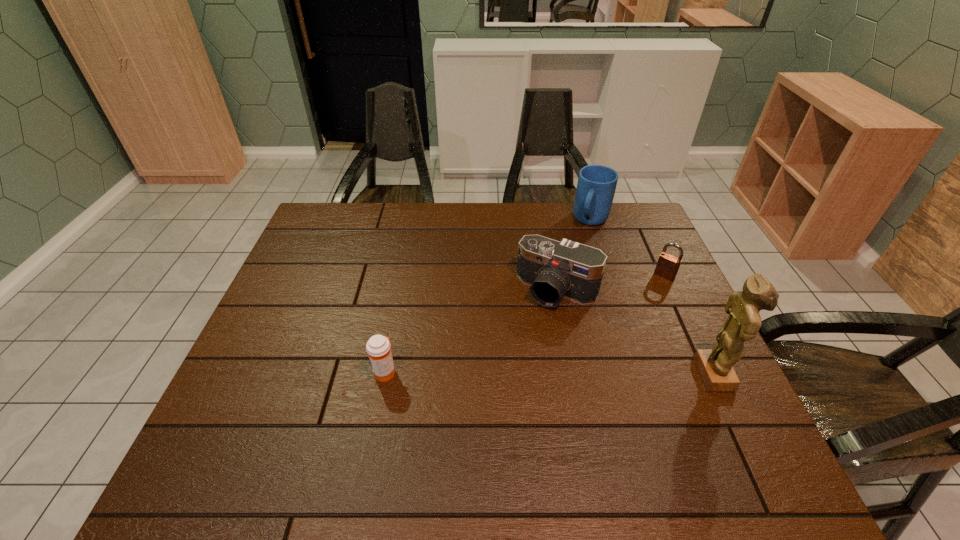
This screenshot has height=540, width=960. Identify the location of vacant space on the desktop that is between the leftmost object and the figurine and is positioned on the front-facing side of the camera. (507, 373).

In order to click on free space on the desktop that is between the leftmost object and the figurine and is positioned on the side of the mug with the handle in this screenshot , I will do `click(516, 373)`.

Locate an element on the screen. This screenshot has width=960, height=540. free space on the desktop that is between the medicine and the tallest object and is positioned on the front-facing side of the padlock is located at coordinates (593, 373).